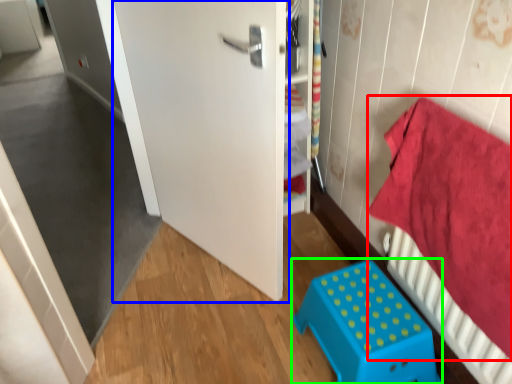
Question: Based on their relative distances, which object is farther from bedding (highlighted by a red box)? Choose from door (highlighted by a blue box) and furniture (highlighted by a green box).

Choices:
 (A) door
 (B) furniture

Answer: (A)